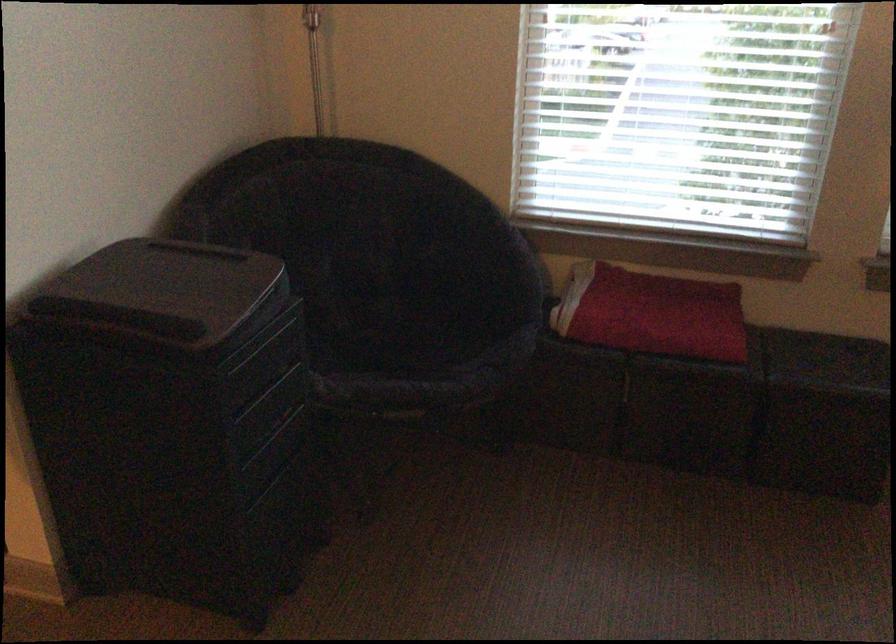
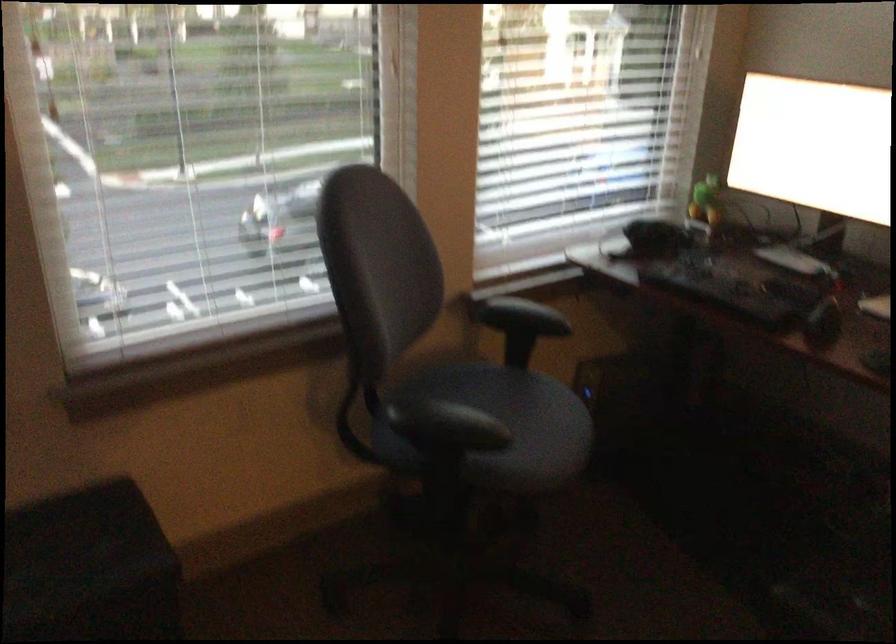
Question: The images are taken continuously from a first-person perspective. In which direction is your viewpoint rotating?

Choices:
 (A) Left
 (B) Right
 (C) Up
 (D) Down

Answer: (B)